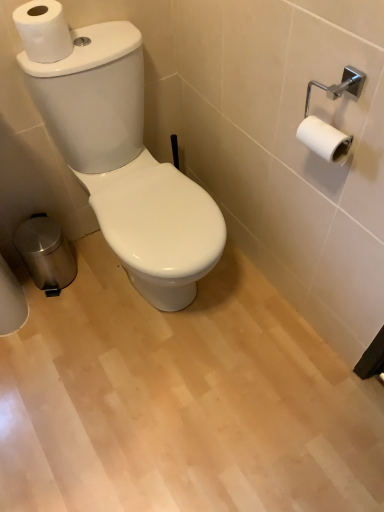
Question: Is white glossy toilet at center to the left or to the right of white matte toilet paper at upper left in the image?

Choices:
 (A) left
 (B) right

Answer: (B)

Question: Do you think white glossy toilet at center is within white matte toilet paper at upper left, or outside of it?

Choices:
 (A) inside
 (B) outside

Answer: (B)

Question: Based on their relative distances, which object is nearer to the polished stainless steel trash bin at lower left?

Choices:
 (A) white glossy toilet at center
 (B) white matte toilet paper at upper left

Answer: (A)

Question: Considering the real-world distances, which object is farthest from the white matte toilet paper at upper left?

Choices:
 (A) polished stainless steel trash bin at lower left
 (B) white glossy toilet at center

Answer: (A)